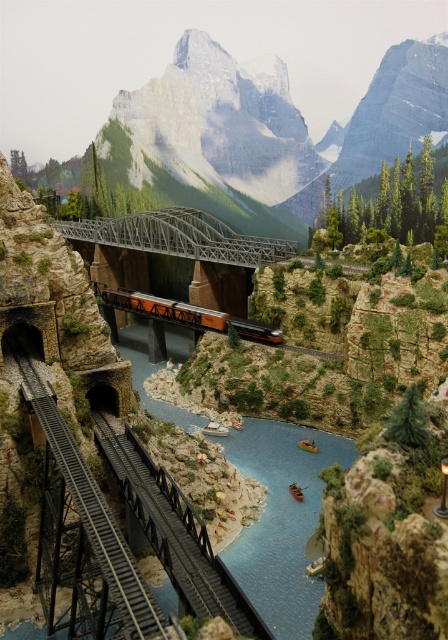
You are standing in front of the miniature diorama of the mountainous landscape. There is a specific point marked at coordinates point (34, 381). If you want to place a new miniature tree exactly 200 feet away from your current position, can you place it at that point?

The point (34, 381) is 204.01 feet away from the viewer, so placing the tree there would be slightly farther than the desired 200 feet. You might need to adjust the placement to a point closer by approximately 4.01 feet.

You are a model train engineer operating the orange and red train on the black railway track. You want to know if you can see the blue glossy water at center from your current position on the bridge. The minimum distance your vision can reach is 50 meters. Can you see it?

The distance between the orange and red train on the black railway track and the blue glossy water at center is 50.56 meters. Since your vision can reach 50 meters, you cannot see the blue glossy water at center from your current position on the bridge.

You are standing at the camera position looking at the miniature diorama. There is a point marked at coordinates point (265, 426) in the scene. If you want to place a small flag exactly at that point, how far in feet would you need to move from your current position to reach it?

The point (265, 426) is 293.49 feet away from the camera position, so you would need to move 293.49 feet to reach it.